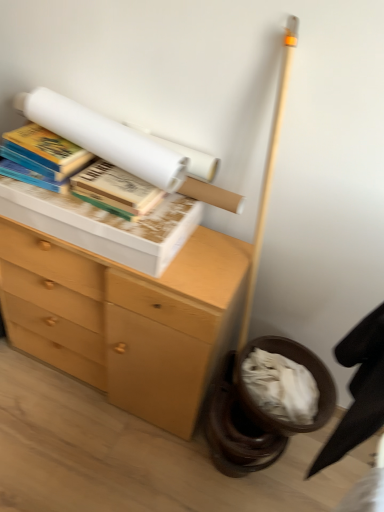
Identify the location of free space in front of hardcover book at upper left, which ranks as the 1th book in left-to-right order. (45, 197).